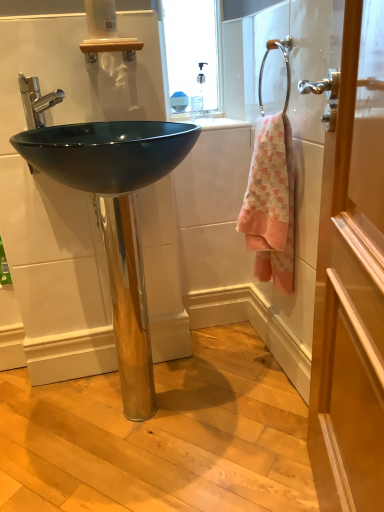
Question: From a real-world perspective, is polished chrome faucet at upper left physically located above or below pink woven towel at right?

Choices:
 (A) above
 (B) below

Answer: (A)

Question: Is polished chrome faucet at upper left to the left or to the right of pink woven towel at right in the image?

Choices:
 (A) right
 (B) left

Answer: (B)

Question: Which is farther from the wooden door at right?

Choices:
 (A) chrome metallic towel ring at upper right
 (B) polished chrome faucet at upper left
 (C) pink woven towel at right
 (D) glossy black sink at center

Answer: (B)

Question: Estimate the real-world distances between objects in this image. Which object is closer to the chrome metallic towel ring at upper right?

Choices:
 (A) glossy black sink at center
 (B) polished chrome faucet at upper left
 (C) pink woven towel at right
 (D) wooden door at right

Answer: (C)